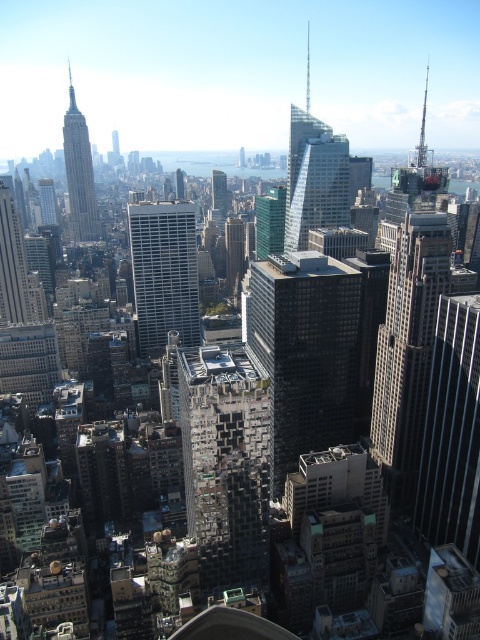
You are a drone operator tasked with flying a drone between the black glass skyscraper at center and the matte glass skyscraper at upper left. According to the scene, which skyscraper is closer to you, the observer?

The black glass skyscraper at center is closer to you since it is positioned in front of the matte glass skyscraper at upper left.

You are an architect analyzing the cityscape. You notice the matte glass skyscraper at upper left and the green glass skyscraper at center. Which one appears closer to you based on their positions in the scene?

The matte glass skyscraper at upper left appears closer because the green glass skyscraper at center is positioned behind it.

You are standing at the observation deck of the Empire State Building and looking out. There are two points in the view ahead of you at coordinates point (267, 291) and point (247, 470). Which point is closer to you?

Point (267, 291) is further to the camera than point (247, 470). Therefore, point (247, 470) is closer to you.